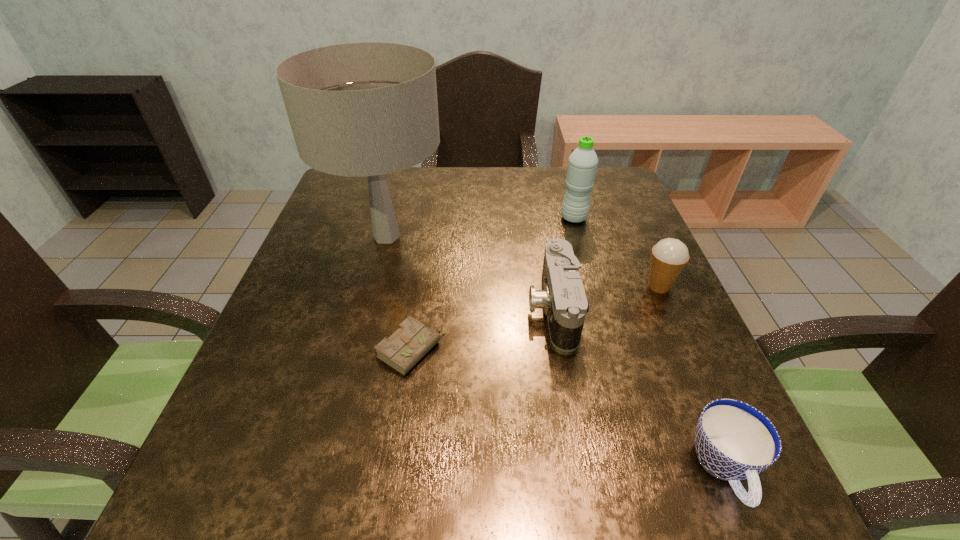
Locate an element on the screen. The image size is (960, 540). vacant space located 0.120m on the back of the fifth shortest object is located at coordinates (565, 188).

Where is `vacant space located 0.100m on the back of the icecream`? vacant space located 0.100m on the back of the icecream is located at coordinates (642, 248).

The width and height of the screenshot is (960, 540). What are the coordinates of `vacant space located on the lens of the camera` in the screenshot? It's located at (415, 308).

At what (x,y) coordinates should I click in order to perform the action: click on vacant space situated 0.150m on the lens of the camera. Please return your answer as a coordinate pair (x, y). This screenshot has height=540, width=960. Looking at the image, I should click on (457, 308).

Locate an element on the screen. This screenshot has height=540, width=960. free space located on the lens of the camera is located at coordinates (381, 308).

This screenshot has width=960, height=540. Find the location of `free space located on the back of the diary`. free space located on the back of the diary is located at coordinates (428, 230).

Identify the location of lampshade at the far edge. Image resolution: width=960 pixels, height=540 pixels. (367, 109).

Find the location of `water bottle that is positioned at the far edge`. water bottle that is positioned at the far edge is located at coordinates (582, 165).

Locate an element on the screen. This screenshot has height=540, width=960. object that is at the near edge is located at coordinates (734, 441).

Locate an element on the screen. Image resolution: width=960 pixels, height=540 pixels. object that is at the left edge is located at coordinates (367, 109).